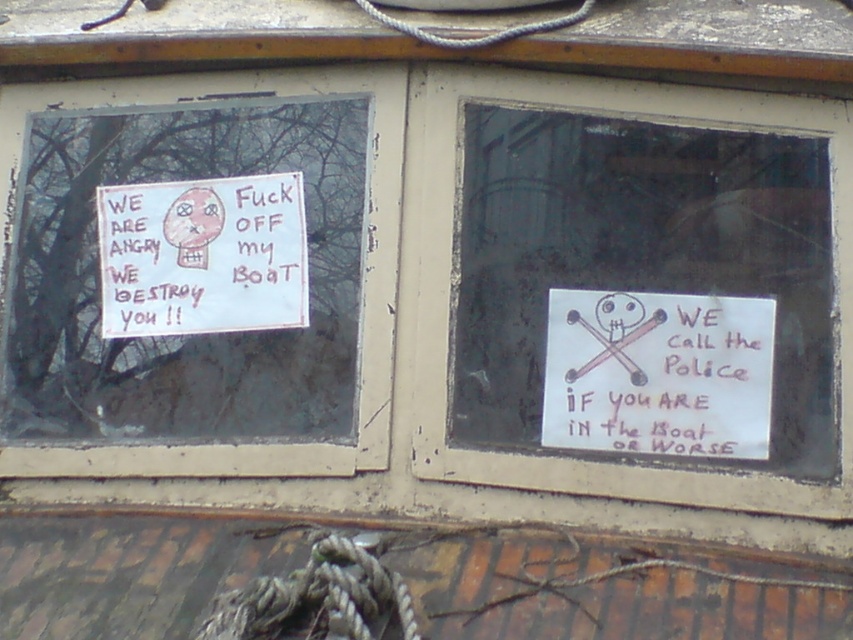
Question: Which point is closer to the camera?

Choices:
 (A) white paper sign at right
 (B) white paper sign at left

Answer: (A)

Question: Does white paper sign at upper left appear under white paper sign at right?

Choices:
 (A) no
 (B) yes

Answer: (A)

Question: Is white paper sign at right closer to camera compared to white paper sign at left?

Choices:
 (A) yes
 (B) no

Answer: (A)

Question: Can you confirm if white paper sign at right is wider than white paper sign at left?

Choices:
 (A) yes
 (B) no

Answer: (B)

Question: Which point is closer to the camera?

Choices:
 (A) white paper sign at right
 (B) white paper sign at left

Answer: (A)

Question: Which point is closer to the camera?

Choices:
 (A) white paper sign at right
 (B) white paper sign at left

Answer: (A)